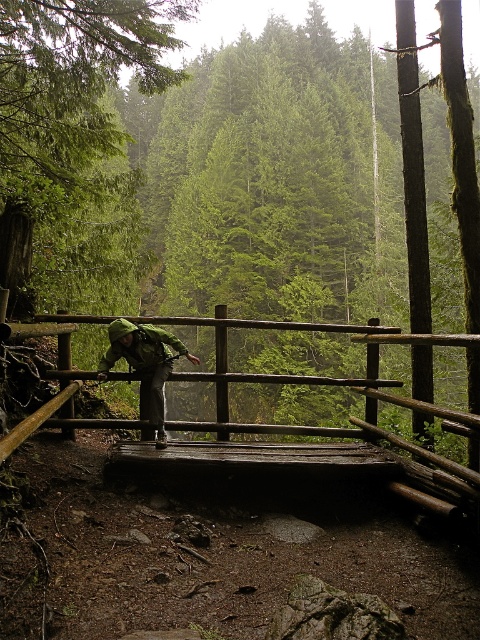
Which is above, wooden bridge at center or green camouflage jacket at center?

green camouflage jacket at center is higher up.

Between point (310, 381) and point (192, 355), which one is positioned behind?

Positioned behind is point (192, 355).

Describe the element at coordinates (358, 436) in the screenshot. I see `wooden bridge at center` at that location.

The width and height of the screenshot is (480, 640). Identify the location of wooden bridge at center. (358, 436).

Between point (360, 384) and point (128, 330), which one is positioned in front?

Point (128, 330)

Who is lower down, wooden bridge at center or green matte jacket at center?

wooden bridge at center is lower down.

Identify the location of wooden bridge at center. The height and width of the screenshot is (640, 480). (358, 436).

The width and height of the screenshot is (480, 640). I want to click on wooden bridge at center, so click(x=358, y=436).

Who is more distant from viewer, [158,438] or [110,356]?

The point [158,438] is more distant.

Is point (156, 374) more distant than point (153, 346)?

Yes.

Where is `green camouflage jacket at center`? green camouflage jacket at center is located at coordinates (144, 364).